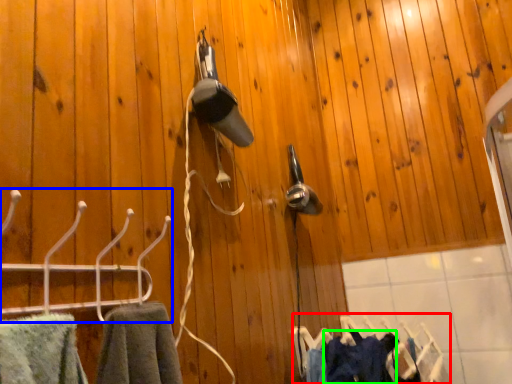
Question: Which is nearer to the laundry (highlighted by a red box)? hanger (highlighted by a blue box) or clothing (highlighted by a green box).

Choices:
 (A) hanger
 (B) clothing

Answer: (B)